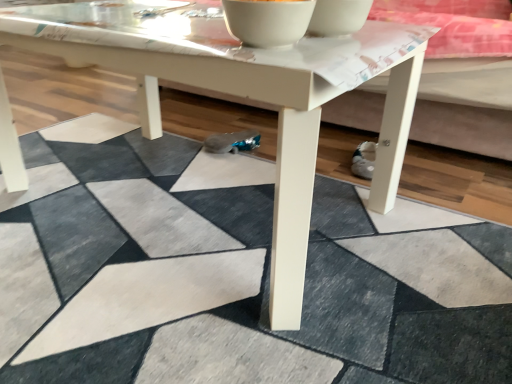
At what (x,y) coordinates should I click in order to perform the action: click on free space that is to the left of white glossy bowl at upper center, which ranks as the 2th bowl in left-to-right order. Please return your answer as a coordinate pair (x, y). The height and width of the screenshot is (384, 512). Looking at the image, I should click on (200, 26).